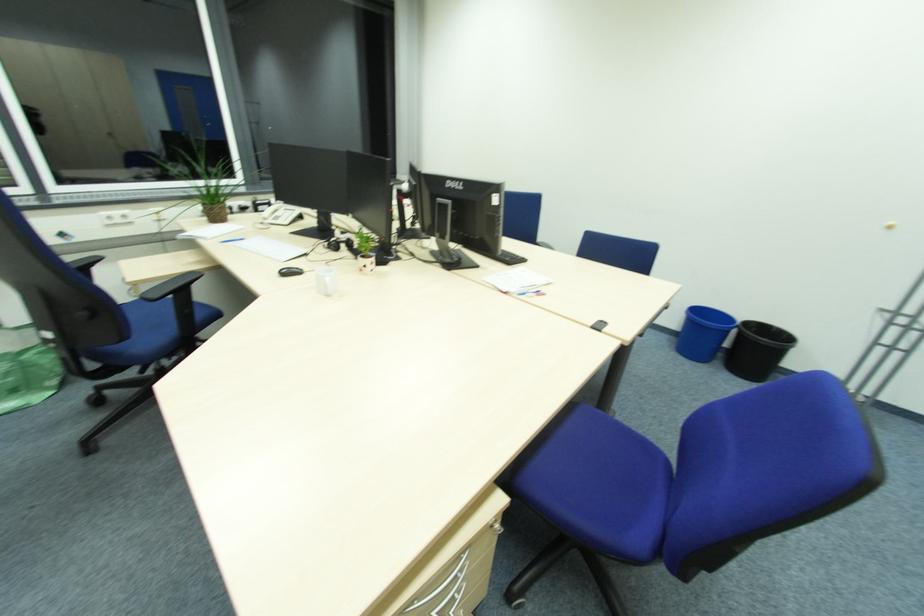
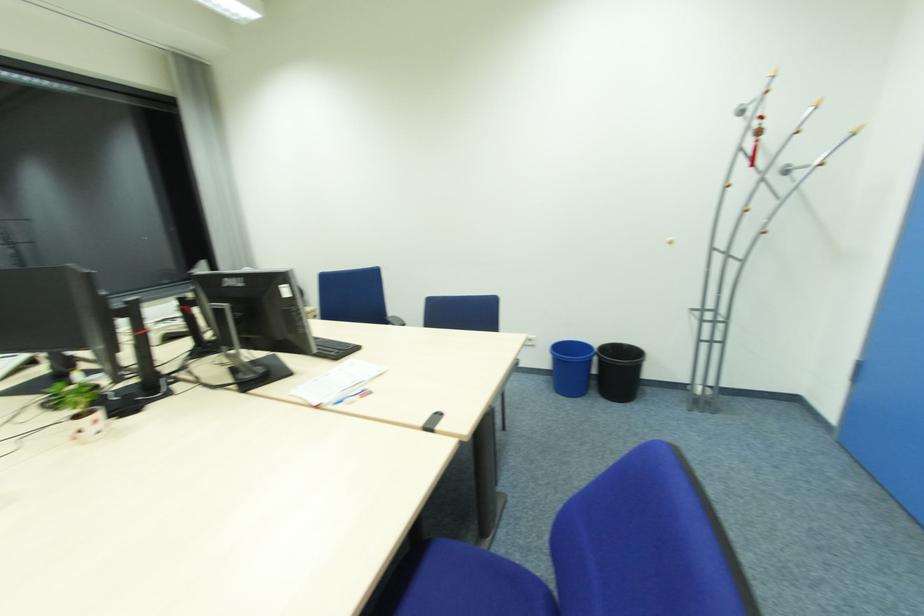
In a continuous first-person perspective shot, in which direction is the camera moving?

The cameraman walked toward right, forward.